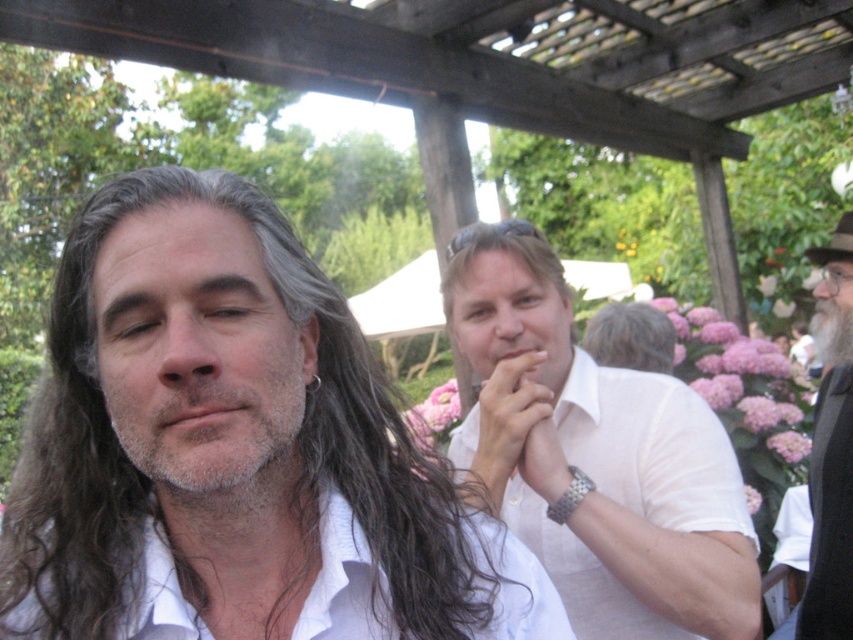
Question: Considering the relative positions of blondehair at center and graywoollybeard at right in the image provided, where is blondehair at center located with respect to graywoollybeard at right?

Choices:
 (A) left
 (B) right

Answer: (A)

Question: From the image, what is the correct spatial relationship of gray matte hair at center in relation to graywoollybeard at right?

Choices:
 (A) left
 (B) right

Answer: (A)

Question: Which point is farther to the camera?

Choices:
 (A) (642, 314)
 (B) (183, 600)
 (C) (822, 449)
 (D) (538, 403)

Answer: (A)

Question: Does white matte shirt at center have a greater width compared to graywoollybeard at right?

Choices:
 (A) yes
 (B) no

Answer: (A)

Question: Which object is closer to the camera taking this photo?

Choices:
 (A) white matte shirt at center
 (B) blondehair at center
 (C) gray matte hair at center

Answer: (A)

Question: Which of these objects is positioned farthest from the white matte dress shirt at left?

Choices:
 (A) gray matte hair at center
 (B) white matte shirt at center
 (C) gray beard at right
 (D) brownwoollyhair at left

Answer: (A)